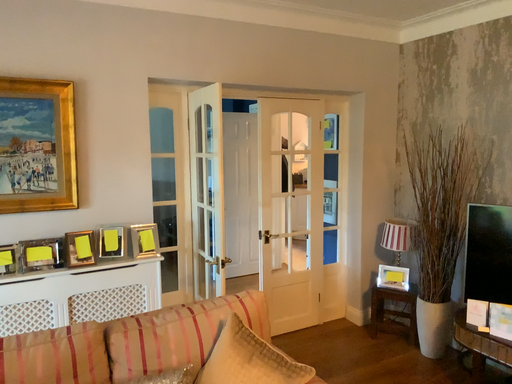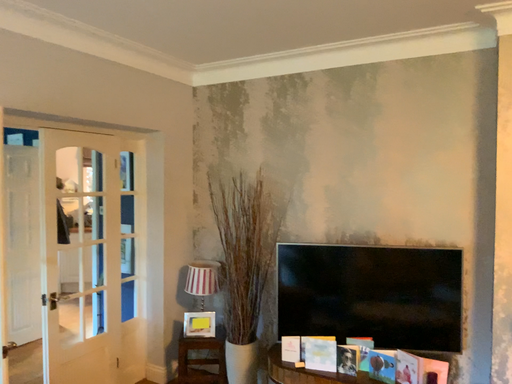
Question: Which way did the camera rotate in the video?

Choices:
 (A) rotated right
 (B) rotated left

Answer: (A)